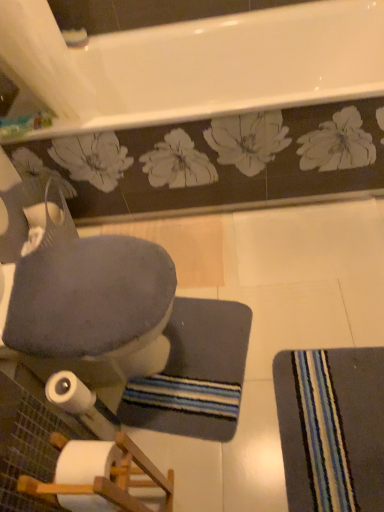
Find the location of a particular element. The image size is (384, 512). white matte toilet paper at lower left is located at coordinates (69, 393).

You are a GUI agent. You are given a task and a screenshot of the screen. Output one action in this format:
    pyautogui.click(x=<x>, y=<y>)
    Task: Click on the velvet gray rocking chair at lower left
    The height and width of the screenshot is (512, 384).
    Given the screenshot: What is the action you would take?
    pyautogui.click(x=89, y=306)

Is striped fabric mat at lower right located within dark gray textured bath mat at center?

That's incorrect, striped fabric mat at lower right is not inside dark gray textured bath mat at center.

Is the position of dark gray textured bath mat at center less distant than that of striped fabric mat at lower right?

No, dark gray textured bath mat at center is behind striped fabric mat at lower right.

Is point (197, 426) farther from camera compared to point (382, 492)?

Yes, it is behind point (382, 492).

This screenshot has width=384, height=512. Find the location of `doormat that is above the dark gray textured bath mat at center (from a real-world perspective)`. doormat that is above the dark gray textured bath mat at center (from a real-world perspective) is located at coordinates (332, 428).

What's the angular difference between white matte toilet paper at lower left and striped fabric mat at lower right's facing directions?

179 degrees.

Looking at this image, which is behind, white matte toilet paper at lower left or striped fabric mat at lower right?

striped fabric mat at lower right is further from the camera.

From a real-world perspective, is white matte toilet paper at lower left physically located above or below striped fabric mat at lower right?

From a real-world perspective, white matte toilet paper at lower left is physically above striped fabric mat at lower right.

Does white matte toilet paper at lower left appear on the right side of velvet gray rocking chair at lower left?

Yes, white matte toilet paper at lower left is to the right of velvet gray rocking chair at lower left.

Does point (56, 389) come behind point (126, 340)?

Yes, point (56, 389) is behind point (126, 340).

How different are the orientations of white matte toilet paper at lower left and velvet gray rocking chair at lower left in degrees?

The angle between the facing direction of white matte toilet paper at lower left and the facing direction of velvet gray rocking chair at lower left is 0.00187 degrees.

Is velvet gray rocking chair at lower left far away from striped fabric mat at lower right?

No, velvet gray rocking chair at lower left is in close proximity to striped fabric mat at lower right.

Which is more to the right, velvet gray rocking chair at lower left or striped fabric mat at lower right?

From the viewer's perspective, striped fabric mat at lower right appears more on the right side.

Is point (116, 358) positioned in front of point (330, 391)?

No.

Is dark gray textured bath mat at center inside velvet gray rocking chair at lower left?

No, dark gray textured bath mat at center is not surrounded by velvet gray rocking chair at lower left.

Considering the sizes of objects velvet gray rocking chair at lower left and dark gray textured bath mat at center in the image provided, who is wider, velvet gray rocking chair at lower left or dark gray textured bath mat at center?

With larger width is velvet gray rocking chair at lower left.

Is velvet gray rocking chair at lower left in contact with dark gray textured bath mat at center?

No, velvet gray rocking chair at lower left is not touching dark gray textured bath mat at center.

Is velvet gray rocking chair at lower left facing towards dark gray textured bath mat at center?

Yes.

From the image's perspective, does dark gray textured bath mat at center appear lower than velvet gray rocking chair at lower left?

Correct, dark gray textured bath mat at center appears lower than velvet gray rocking chair at lower left in the image.

Looking at the image, does dark gray textured bath mat at center seem bigger or smaller compared to velvet gray rocking chair at lower left?

Considering their sizes, dark gray textured bath mat at center takes up less space than velvet gray rocking chair at lower left.

Are dark gray textured bath mat at center and velvet gray rocking chair at lower left located far from each other?

No.

Would you say velvet gray rocking chair at lower left is part of dark gray textured bath mat at center's contents?

That's incorrect, velvet gray rocking chair at lower left is not inside dark gray textured bath mat at center.

From the image's perspective, is striped fabric mat at lower right under velvet gray rocking chair at lower left?

Yes, from the image's perspective, striped fabric mat at lower right is beneath velvet gray rocking chair at lower left.

Is striped fabric mat at lower right positioned with its back to velvet gray rocking chair at lower left?

No, velvet gray rocking chair at lower left is not at the back of striped fabric mat at lower right.

Considering the positions of objects striped fabric mat at lower right and velvet gray rocking chair at lower left in the image provided, who is more to the left, striped fabric mat at lower right or velvet gray rocking chair at lower left?

From the viewer's perspective, velvet gray rocking chair at lower left appears more on the left side.

From the picture: Is striped fabric mat at lower right far from velvet gray rocking chair at lower left?

That's not correct — striped fabric mat at lower right is a little close to velvet gray rocking chair at lower left.

In order to click on bath mat that is on the left side of striped fabric mat at lower right in this screenshot , I will do (195, 373).

Identify the location of toilet paper above the striped fabric mat at lower right (from the image's perspective). (69, 393).

From the image, which object appears to be nearer to white matte toilet paper at lower left, striped fabric mat at lower right or dark gray textured bath mat at center?

dark gray textured bath mat at center.

Consider the image. Estimate the real-world distances between objects in this image. Which object is closer to velvet gray rocking chair at lower left, striped fabric mat at lower right or dark gray textured bath mat at center?

dark gray textured bath mat at center lies closer to velvet gray rocking chair at lower left than the other object.

From the image, which object appears to be nearer to dark gray textured bath mat at center, velvet gray rocking chair at lower left or white matte toilet paper at lower left?

Based on the image, velvet gray rocking chair at lower left appears to be nearer to dark gray textured bath mat at center.

Which object lies nearer to the anchor point striped fabric mat at lower right, velvet gray rocking chair at lower left or white matte toilet paper at lower left?

The object closer to striped fabric mat at lower right is velvet gray rocking chair at lower left.

Estimate the real-world distances between objects in this image. Which object is further from striped fabric mat at lower right, white matte toilet paper at lower left or velvet gray rocking chair at lower left?

Among the two, white matte toilet paper at lower left is located further to striped fabric mat at lower right.

From the image, which object appears to be farther from velvet gray rocking chair at lower left, white matte toilet paper at lower left or striped fabric mat at lower right?

striped fabric mat at lower right.

Considering their positions, is striped fabric mat at lower right positioned closer to velvet gray rocking chair at lower left than white matte toilet paper at lower left?

The object closer to velvet gray rocking chair at lower left is white matte toilet paper at lower left.

Based on their spatial positions, is white matte toilet paper at lower left or velvet gray rocking chair at lower left closer to dark gray textured bath mat at center?

The object closer to dark gray textured bath mat at center is velvet gray rocking chair at lower left.

I want to click on toilet paper between velvet gray rocking chair at lower left and striped fabric mat at lower right from left to right, so click(69, 393).

In order to click on bath mat between velvet gray rocking chair at lower left and striped fabric mat at lower right from left to right in this screenshot , I will do `click(195, 373)`.

Find the location of a particular element. This screenshot has height=512, width=384. bath mat between white matte toilet paper at lower left and striped fabric mat at lower right from left to right is located at coordinates (195, 373).

The height and width of the screenshot is (512, 384). I want to click on toilet paper between velvet gray rocking chair at lower left and dark gray textured bath mat at center in the front-back direction, so click(x=69, y=393).